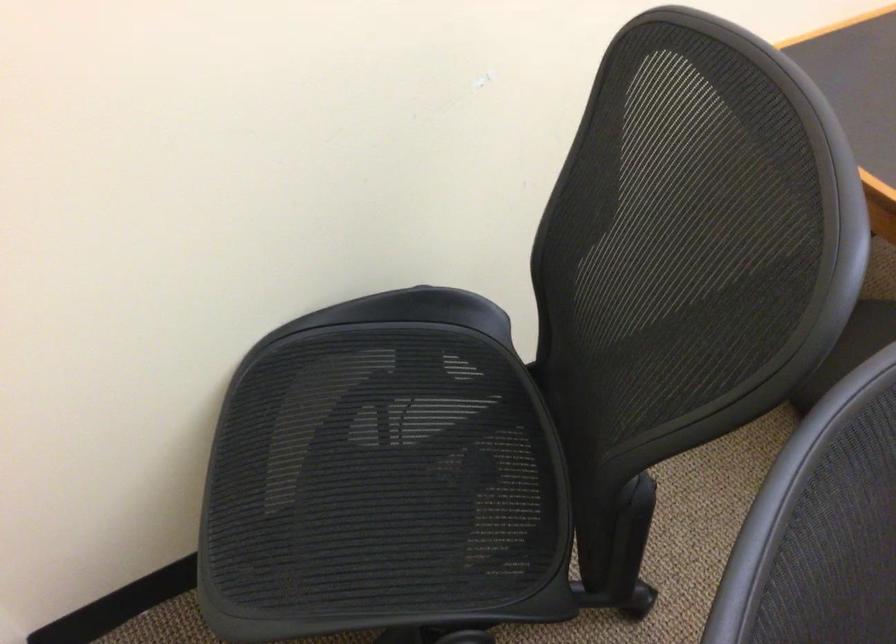
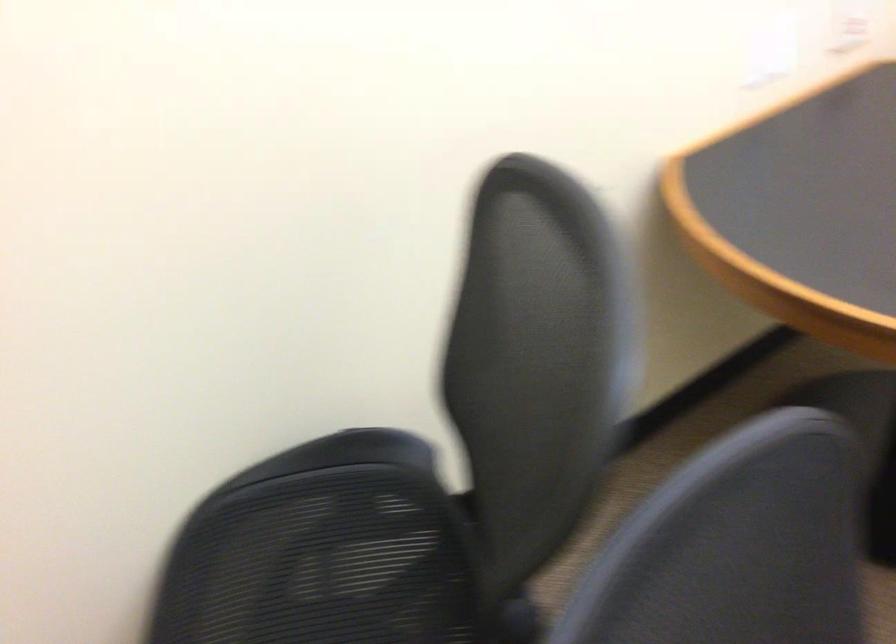
Question: The images are taken continuously from a first-person perspective. In which direction is your viewpoint rotating?

Choices:
 (A) Left
 (B) Right
 (C) Up
 (D) Down

Answer: (C)